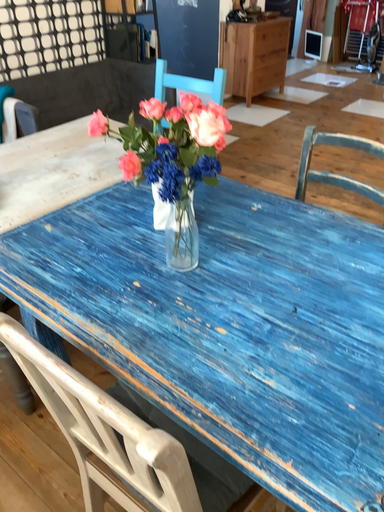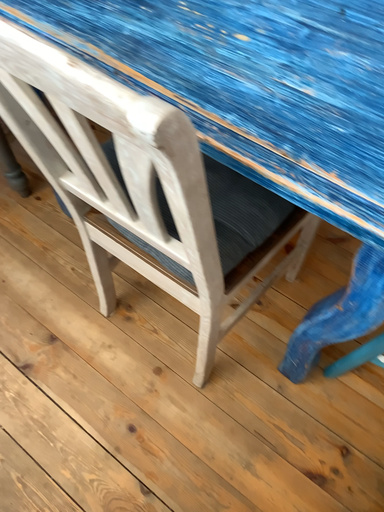
Question: How did the camera likely rotate when shooting the video?

Choices:
 (A) rotated upward
 (B) rotated downward

Answer: (B)